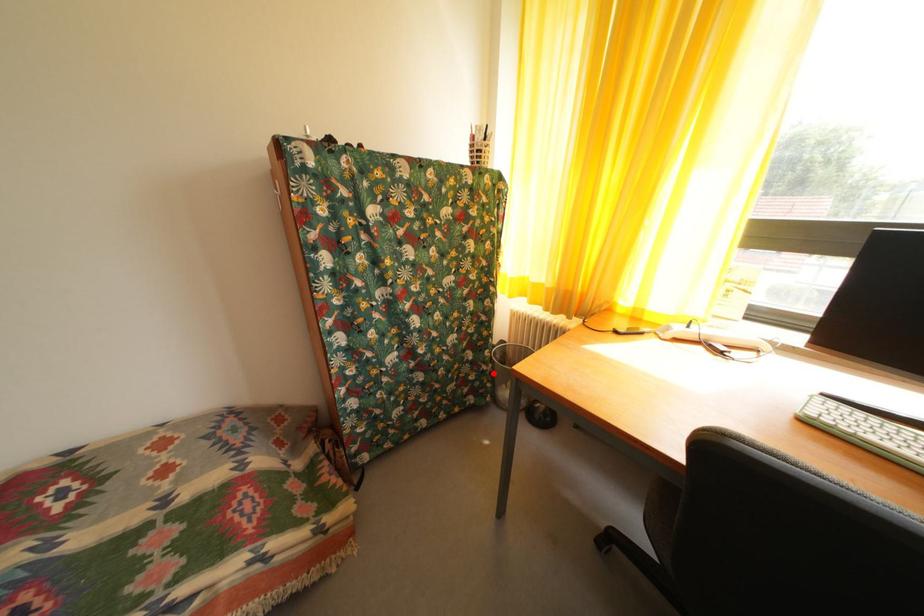
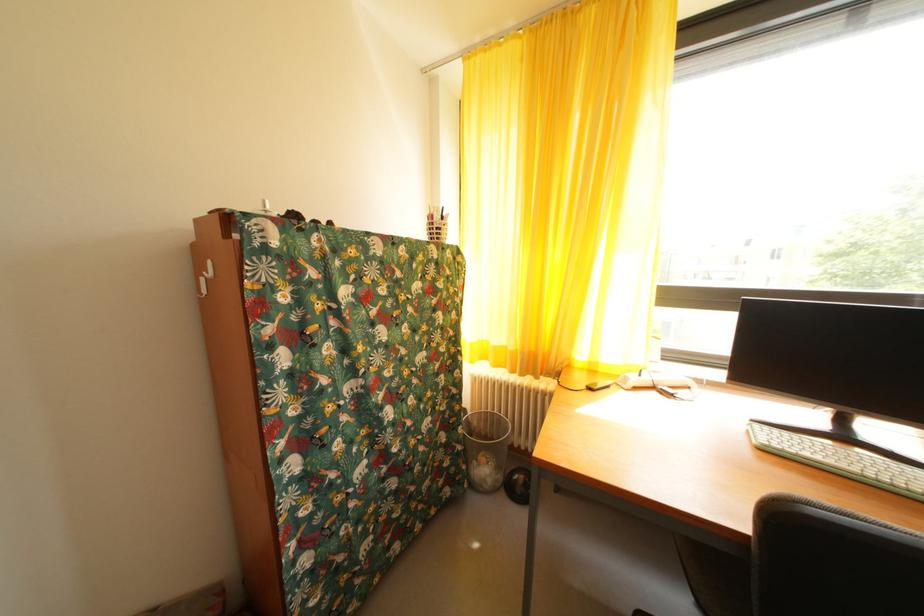
Locate, in the second image, the point that corresponds to the highlighted location in the first image.

(468, 454)